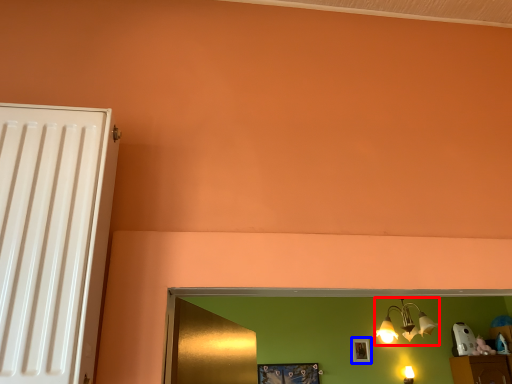
Question: Which of the following is the farthest to the observer, lamp (highlighted by a red box) or picture frame (highlighted by a blue box)?

Choices:
 (A) lamp
 (B) picture frame

Answer: (B)